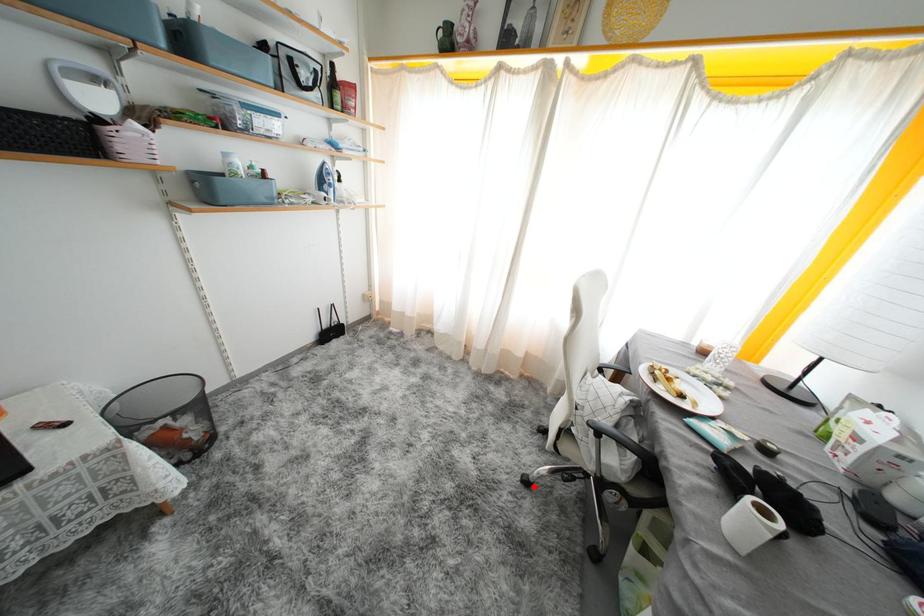
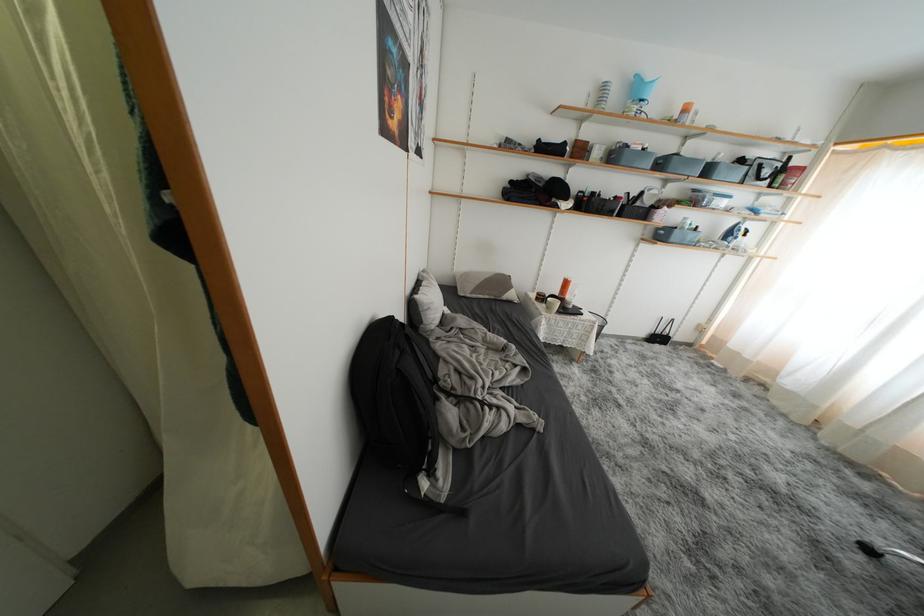
Question: I am providing you with two images of the same scene from different viewpoints. A red point is marked on the first image. At the location where the point appears in image 1, is it still visible in image 2?

Choices:
 (A) Yes
 (B) No

Answer: (A)